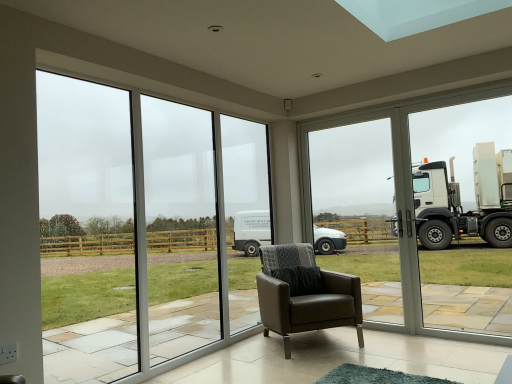
Question: Would you say brown leather armchair at center is part of clear glass window at right's contents?

Choices:
 (A) no
 (B) yes

Answer: (A)

Question: Is clear glass window at right shorter than brown leather armchair at center?

Choices:
 (A) no
 (B) yes

Answer: (A)

Question: From a real-world perspective, is clear glass window at right under brown leather armchair at center?

Choices:
 (A) no
 (B) yes

Answer: (A)

Question: Is clear glass window at right closer to camera compared to brown leather armchair at center?

Choices:
 (A) yes
 (B) no

Answer: (A)

Question: Considering the relative sizes of clear glass window at right and brown leather armchair at center in the image provided, is clear glass window at right smaller than brown leather armchair at center?

Choices:
 (A) no
 (B) yes

Answer: (B)

Question: Considering the relative sizes of clear glass window at right and brown leather armchair at center in the image provided, is clear glass window at right taller than brown leather armchair at center?

Choices:
 (A) yes
 (B) no

Answer: (A)

Question: Is transparent glass door at center inside brown leather armchair at center?

Choices:
 (A) yes
 (B) no

Answer: (B)

Question: Could you tell me if brown leather armchair at center is turned towards transparent glass door at center?

Choices:
 (A) no
 (B) yes

Answer: (A)

Question: Is brown leather armchair at center taller than transparent glass door at center?

Choices:
 (A) yes
 (B) no

Answer: (B)

Question: Does brown leather armchair at center have a smaller size compared to transparent glass door at center?

Choices:
 (A) yes
 (B) no

Answer: (B)

Question: Considering the relative sizes of brown leather armchair at center and transparent glass door at center in the image provided, is brown leather armchair at center bigger than transparent glass door at center?

Choices:
 (A) no
 (B) yes

Answer: (B)

Question: From a real-world perspective, is brown leather armchair at center beneath transparent glass door at center?

Choices:
 (A) yes
 (B) no

Answer: (A)

Question: Is clear glass window at right to the right of transparent glass window at left from the viewer's perspective?

Choices:
 (A) yes
 (B) no

Answer: (A)